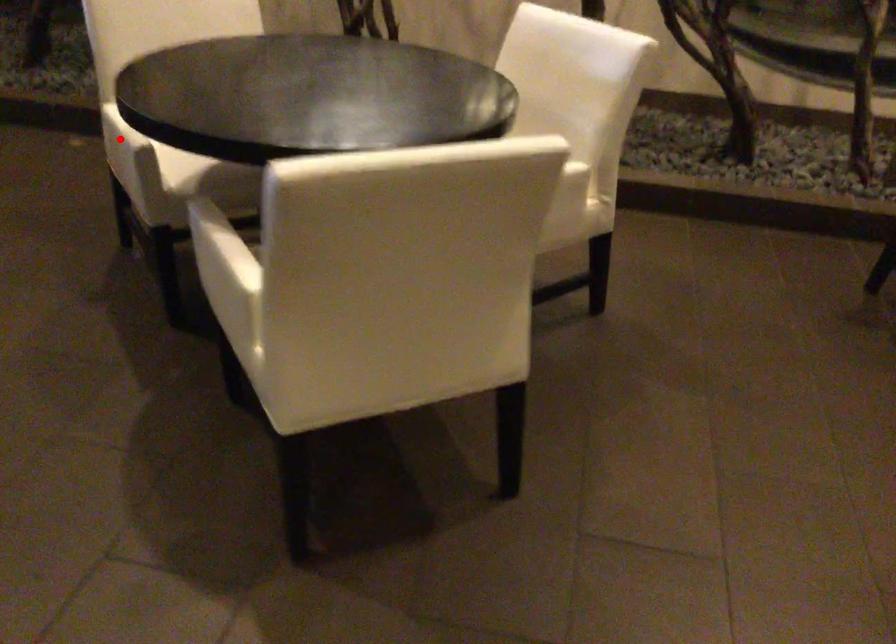
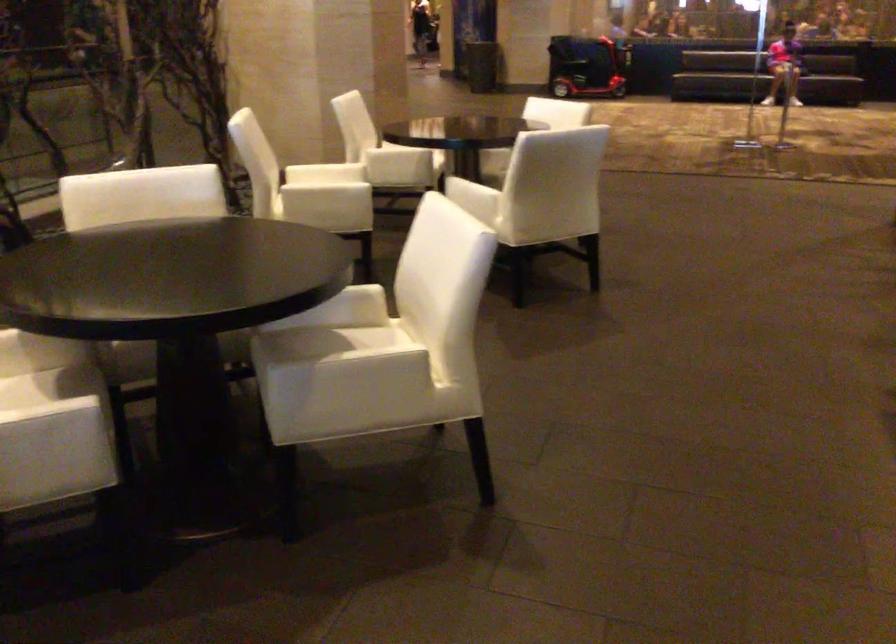
Question: I am providing you with two images of the same scene from different viewpoints. In image1, a red point is highlighted. Considering the same 3D point in image2, which of the following is correct?

Choices:
 (A) It is closer
 (B) It is farther

Answer: (A)